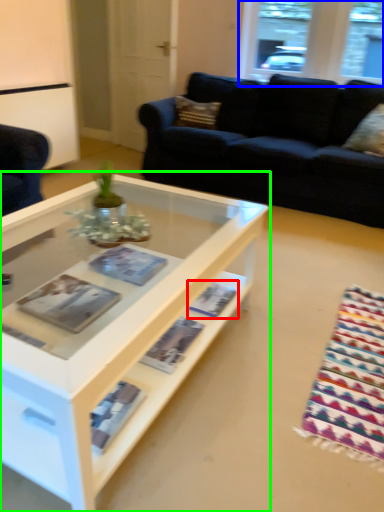
Question: Estimate the real-world distances between objects in this image. Which object is closer to magazine (highlighted by a red box), window (highlighted by a blue box) or coffee table (highlighted by a green box)?

Choices:
 (A) window
 (B) coffee table

Answer: (B)